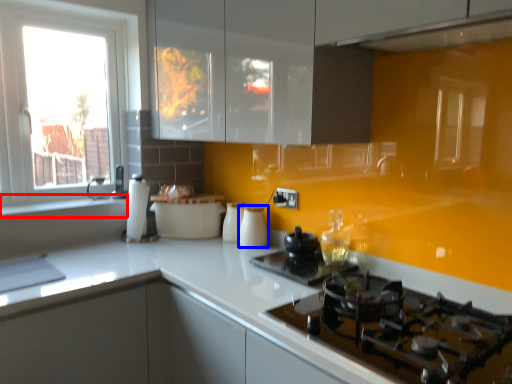
Question: Which object is closer to the camera taking this photo, window sill (highlighted by a red box) or kitchen appliance (highlighted by a blue box)?

Choices:
 (A) window sill
 (B) kitchen appliance

Answer: (A)